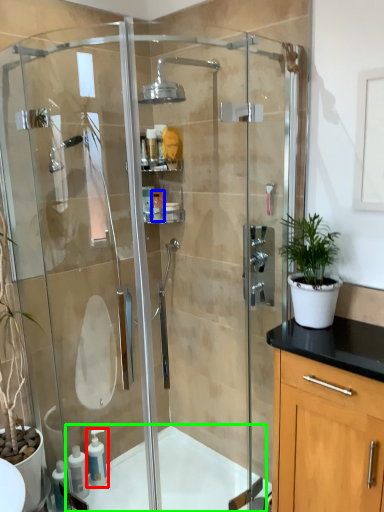
Question: Estimate the real-world distances between objects in this image. Which object is closer to soap dispenser (highlighted by a red box), toiletry (highlighted by a blue box) or bath (highlighted by a green box)?

Choices:
 (A) toiletry
 (B) bath

Answer: (B)